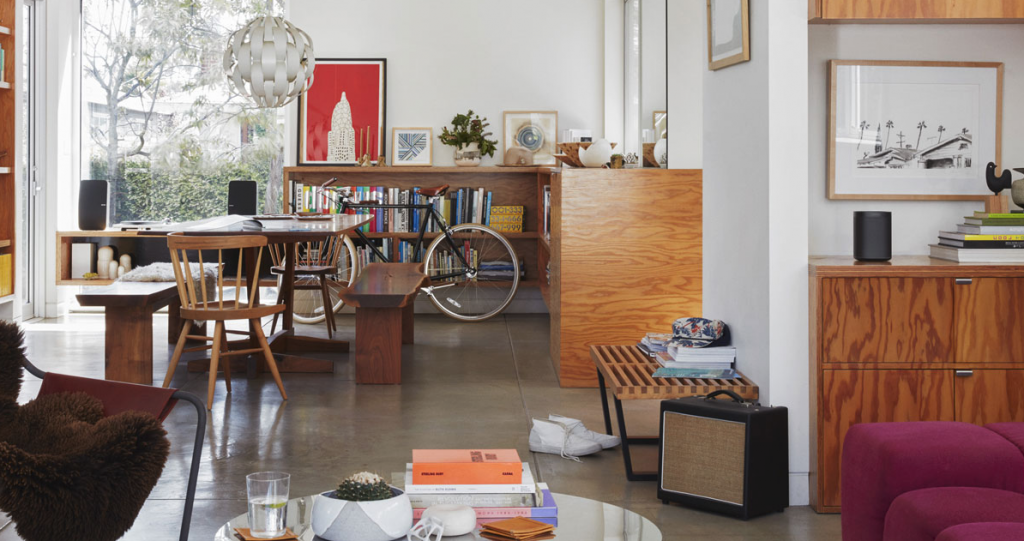
Find the location of a particular element. speaker is located at coordinates (695, 443).